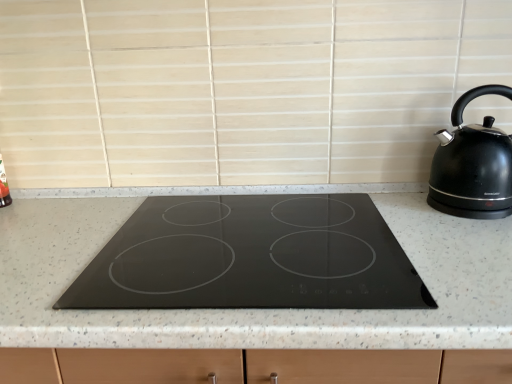
Question: Is black glossy kettle at right in contact with black granite countertop at center?

Choices:
 (A) yes
 (B) no

Answer: (B)

Question: Is black glossy kettle at right oriented towards black granite countertop at center?

Choices:
 (A) yes
 (B) no

Answer: (B)

Question: Can you confirm if black glossy kettle at right is thinner than black granite countertop at center?

Choices:
 (A) no
 (B) yes

Answer: (B)

Question: Can you confirm if black glossy kettle at right is positioned to the left of black granite countertop at center?

Choices:
 (A) yes
 (B) no

Answer: (B)

Question: Can you confirm if black glossy kettle at right is taller than black granite countertop at center?

Choices:
 (A) yes
 (B) no

Answer: (B)

Question: Can you confirm if black glossy kettle at right is bigger than black granite countertop at center?

Choices:
 (A) no
 (B) yes

Answer: (A)

Question: Can you confirm if black granite countertop at center is positioned to the right of black glossy kettle at right?

Choices:
 (A) yes
 (B) no

Answer: (B)

Question: Is black granite countertop at center positioned far away from black glossy kettle at right?

Choices:
 (A) no
 (B) yes

Answer: (A)

Question: From the image's perspective, would you say black granite countertop at center is shown under black glossy kettle at right?

Choices:
 (A) no
 (B) yes

Answer: (B)

Question: Is black granite countertop at center beside black glossy kettle at right?

Choices:
 (A) no
 (B) yes

Answer: (A)

Question: Does black granite countertop at center have a smaller size compared to black glossy kettle at right?

Choices:
 (A) no
 (B) yes

Answer: (A)

Question: From a real-world perspective, is black granite countertop at center beneath black glossy kettle at right?

Choices:
 (A) no
 (B) yes

Answer: (B)

Question: Considering the relative positions of black glossy kettle at right and black granite countertop at center in the image provided, is black glossy kettle at right to the left or to the right of black granite countertop at center?

Choices:
 (A) right
 (B) left

Answer: (A)